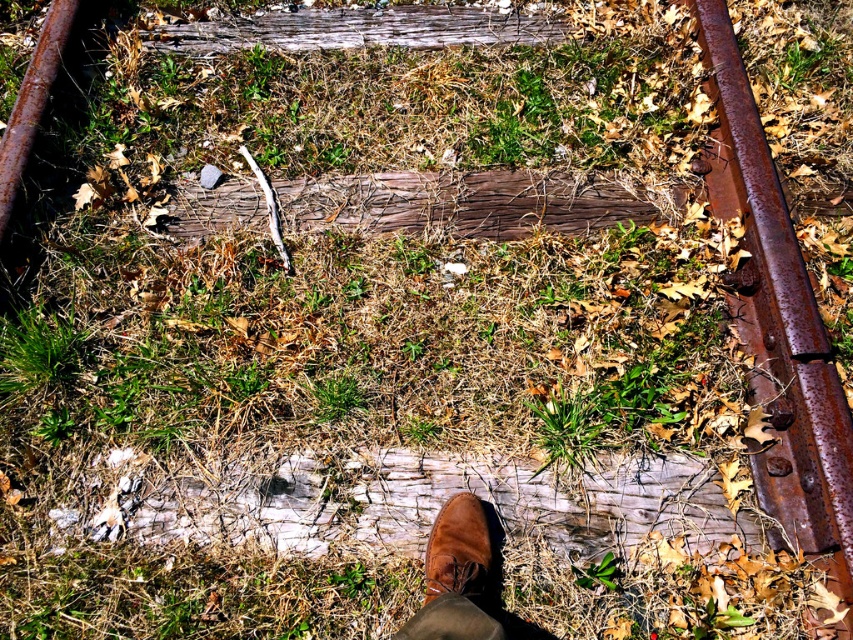
Question: In this image, where is rusty metal train track at right located relative to brown suede shoe at center?

Choices:
 (A) below
 (B) above

Answer: (B)

Question: Among these objects, which one is farthest from the camera?

Choices:
 (A) rusty metal train track at right
 (B) brown suede shoe at center

Answer: (A)

Question: From the image, what is the correct spatial relationship of rusty metal train track at right in relation to brown suede shoe at center?

Choices:
 (A) right
 (B) left

Answer: (A)

Question: Is the position of rusty metal train track at right more distant than that of brown suede shoe at center?

Choices:
 (A) yes
 (B) no

Answer: (A)